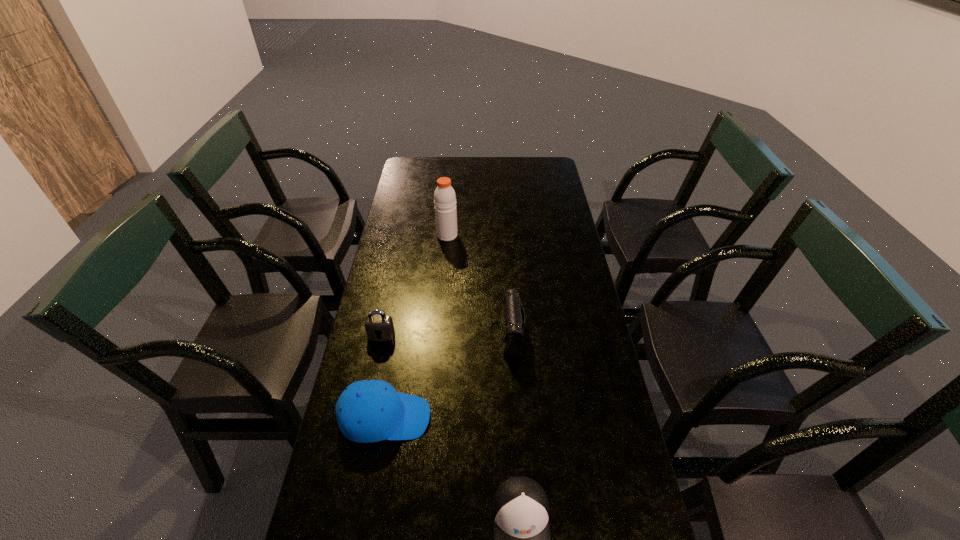
Find the location of a particular element. The image size is (960, 540). free space located 0.360m on the front flap of the clutch bag is located at coordinates (373, 334).

Identify the location of free spot located 0.390m on the front-facing side of the taller cap. (579, 417).

Locate an element on the screen. Image resolution: width=960 pixels, height=540 pixels. padlock located in the left edge section of the desktop is located at coordinates (379, 327).

Locate an element on the screen. The height and width of the screenshot is (540, 960). cap that is at the left edge is located at coordinates (368, 411).

Where is `vacant space at the far edge`? Image resolution: width=960 pixels, height=540 pixels. vacant space at the far edge is located at coordinates (451, 174).

You are a GUI agent. You are given a task and a screenshot of the screen. Output one action in this format:
    pyautogui.click(x=<x>, y=<y>)
    Task: Click on the free point at the left edge
    
    Given the screenshot: What is the action you would take?
    pyautogui.click(x=393, y=379)

At what (x,y) coordinates should I click in order to perform the action: click on free space at the right edge of the desktop. Please return your answer as a coordinate pair (x, y). Looking at the image, I should click on (532, 195).

The width and height of the screenshot is (960, 540). I want to click on vacant space at the far left corner of the desktop, so click(424, 168).

Identify the location of vacant point located between the second nearest object and the tallest object. The image size is (960, 540). pyautogui.click(x=416, y=326).

You are a GUI agent. You are given a task and a screenshot of the screen. Output one action in this format:
    pyautogui.click(x=<x>, y=<y>)
    Task: Click on the empty space that is in between the clutch bag and the taller cap
    The image size is (960, 540).
    Given the screenshot: What is the action you would take?
    point(445,376)